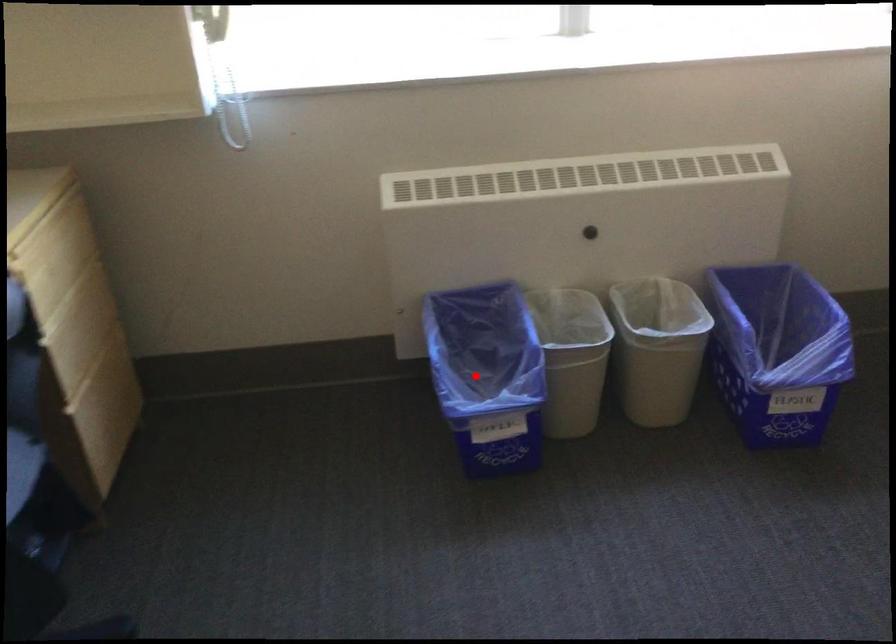
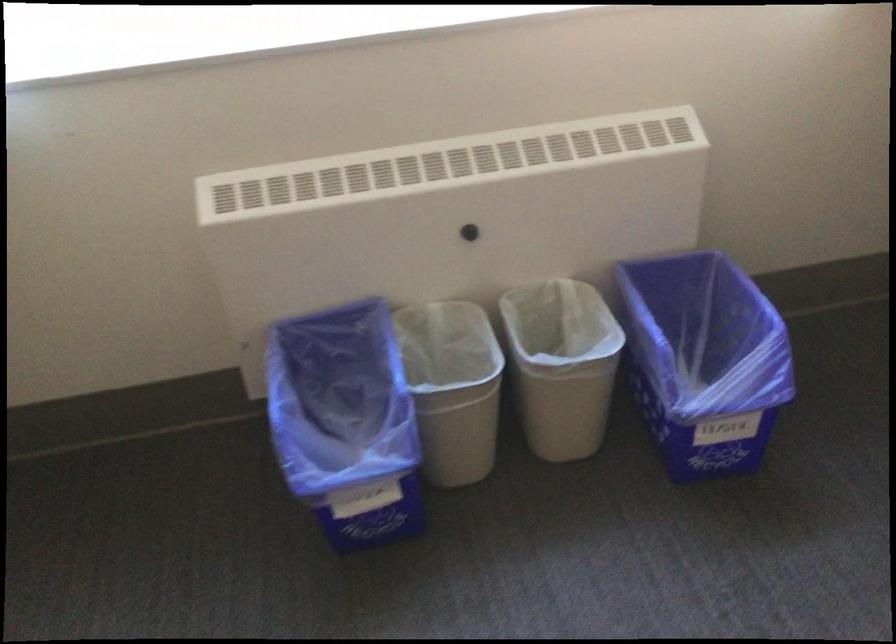
In the second image, find the point that corresponds to the highlighted location in the first image.

(345, 422)